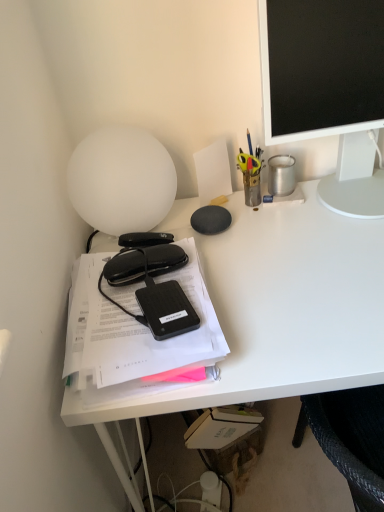
Locate an element on the screen. This screenshot has width=384, height=512. free spot below matte black monitor at upper right (from a real-world perspective) is located at coordinates (329, 198).